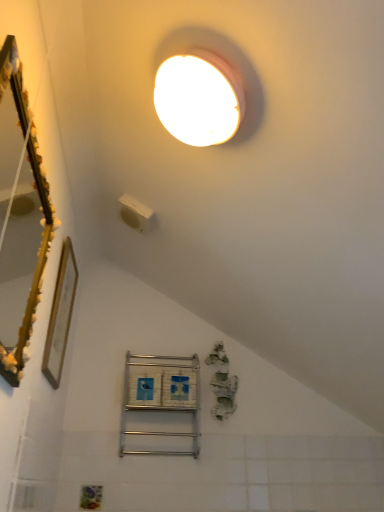
Question: Considering the positions of white plastic light switch at upper center and gold wooden picture frame at left in the image, is white plastic light switch at upper center taller or shorter than gold wooden picture frame at left?

Choices:
 (A) short
 (B) tall

Answer: (A)

Question: From the image's perspective, is white plastic light switch at upper center above or below gold wooden picture frame at left?

Choices:
 (A) above
 (B) below

Answer: (A)

Question: Considering the real-world distances, which object is farthest from the gold textured mirror at left?

Choices:
 (A) metallic silver shelf at center
 (B) gold wooden picture frame at left
 (C) white plastic light switch at upper center

Answer: (A)

Question: Which of these objects is positioned farthest from the metallic silver shelf at center?

Choices:
 (A) white plastic light switch at upper center
 (B) gold textured mirror at left
 (C) gold wooden picture frame at left

Answer: (A)